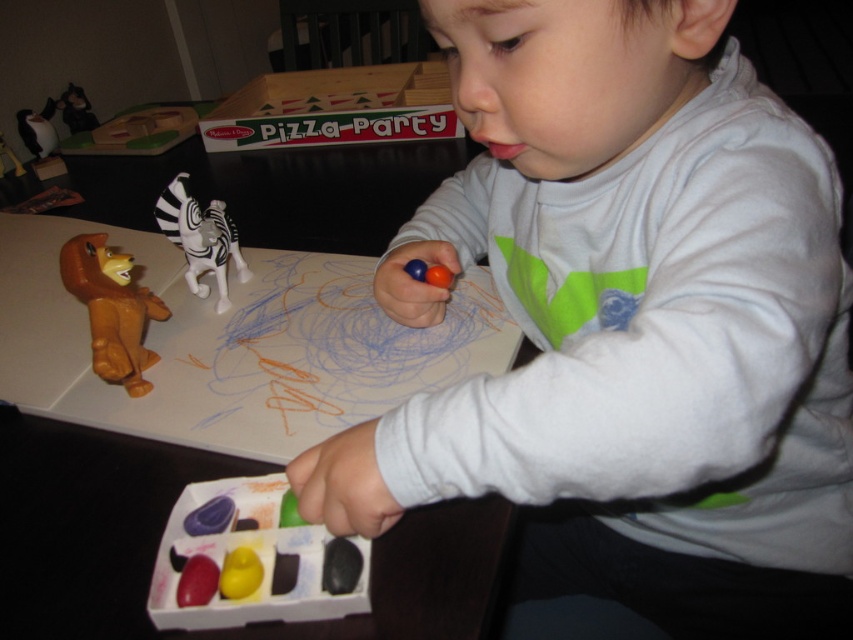
You are a parent helping your child with an art project. You need to ensure the white matte shirt at center doesn not get stained by the smooth plastic crayons at lower center. Based on their positions, is there a risk of the shirt coming into contact with the crayons?

The white matte shirt at center is located above the smooth plastic crayons at lower center, so there is a risk of the shirt coming into contact with the crayons if the child moves downward or the shirt shifts downward.

You are a parent trying to organize the child drawing area. The smooth plastic crayons at lower center are currently at point (254, 557). If you want to move them to a new location that is 0.1 units higher on the y axis, what would be the new coordinates?

The new coordinates would be 0.872, 0.399.